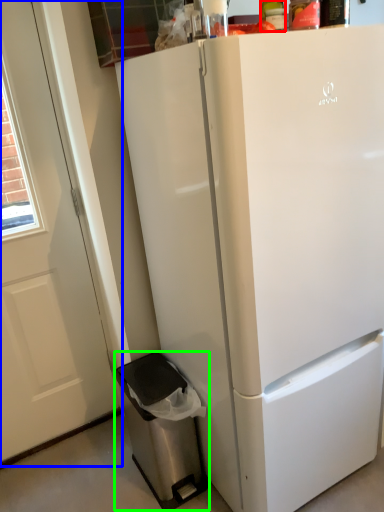
Question: Which object is the farthest from bottle (highlighted by a red box)? Choose among these: screen door (highlighted by a blue box) or dish washer (highlighted by a green box).

Choices:
 (A) screen door
 (B) dish washer

Answer: (B)